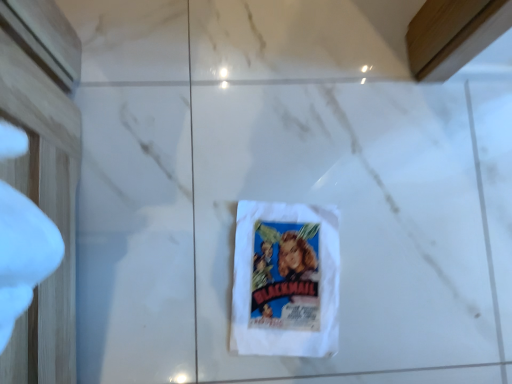
What are the coordinates of `free spot above white paper bag at center (from a real-world perspective)` in the screenshot? It's located at (279, 266).